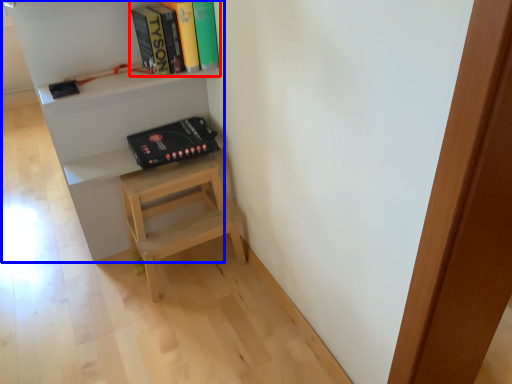
Question: Which object is further to the camera taking this photo, book (highlighted by a red box) or shelf (highlighted by a blue box)?

Choices:
 (A) book
 (B) shelf

Answer: (A)